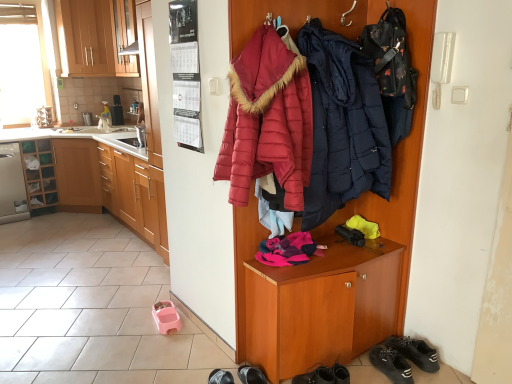
You are a GUI agent. You are given a task and a screenshot of the screen. Output one action in this format:
    pyautogui.click(x=<x>, y=<y>)
    Task: Click on the vacant area that is in front of wooden cabinet at left, which ranks as the first cabinetry in right-to-left order
    Image resolution: width=512 pixels, height=384 pixels.
    Given the screenshot: What is the action you would take?
    pyautogui.click(x=96, y=273)